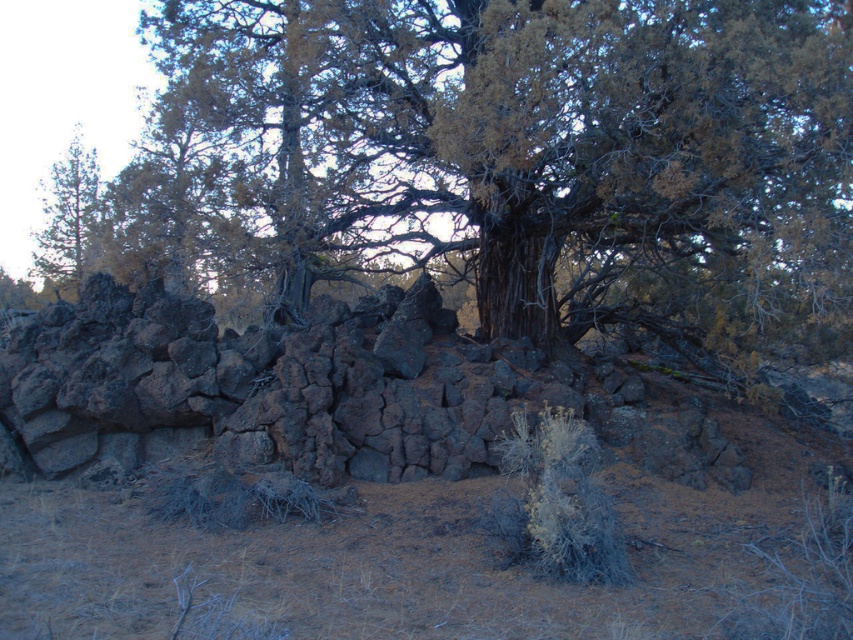
You are a hiker trying to determine which tree has a larger trunk. You see the dark brown bark tree at center and the green pine tree at left. Based on the scene, which tree likely has a wider trunk?

The dark brown bark tree at center might be wider than green pine tree at left, so it likely has a wider trunk.

You are a hiker who wants to take a photo of the dark brown bark tree at center. You are currently standing at the origin point of the coordinate system. What are the coordinates of the tree?

The coordinates of the dark brown bark tree at center are at point (503, 161).

You are standing at the edge of a forest and see the dark brown bark tree at center and the green pine tree at left. Which tree is closer to your right side?

The dark brown bark tree at center is to the right of the green pine tree at left, so the dark brown bark tree at center is closer to your right side.